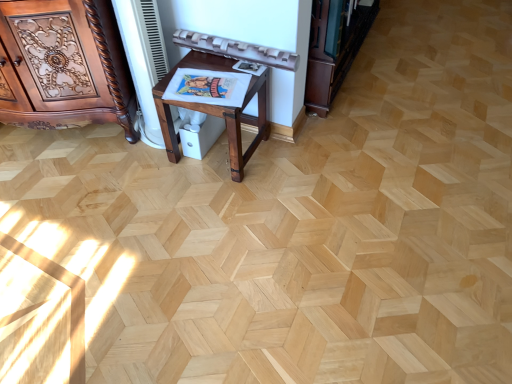
Question: Do you think dark brown wood bookshelf at upper right is within polished wood cabinet at left, or outside of it?

Choices:
 (A) outside
 (B) inside

Answer: (A)

Question: Based on their positions, is dark brown wood bookshelf at upper right located to the left or right of polished wood cabinet at left?

Choices:
 (A) left
 (B) right

Answer: (B)

Question: Which object is positioned farthest from the dark brown wood bookshelf at upper right?

Choices:
 (A) polished wood cabinet at left
 (B) mahogany wood table at center

Answer: (A)

Question: Which is nearer to the dark brown wood bookshelf at upper right?

Choices:
 (A) mahogany wood table at center
 (B) polished wood cabinet at left

Answer: (A)